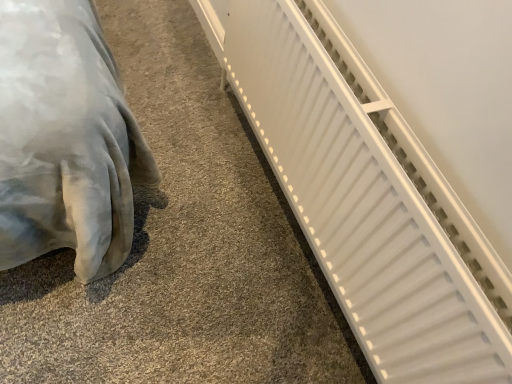
This screenshot has width=512, height=384. In order to click on white matte radiator at right in this screenshot , I will do `click(366, 196)`.

What do you see at coordinates (366, 196) in the screenshot?
I see `white matte radiator at right` at bounding box center [366, 196].

Where is `white matte radiator at right`? The image size is (512, 384). white matte radiator at right is located at coordinates (366, 196).